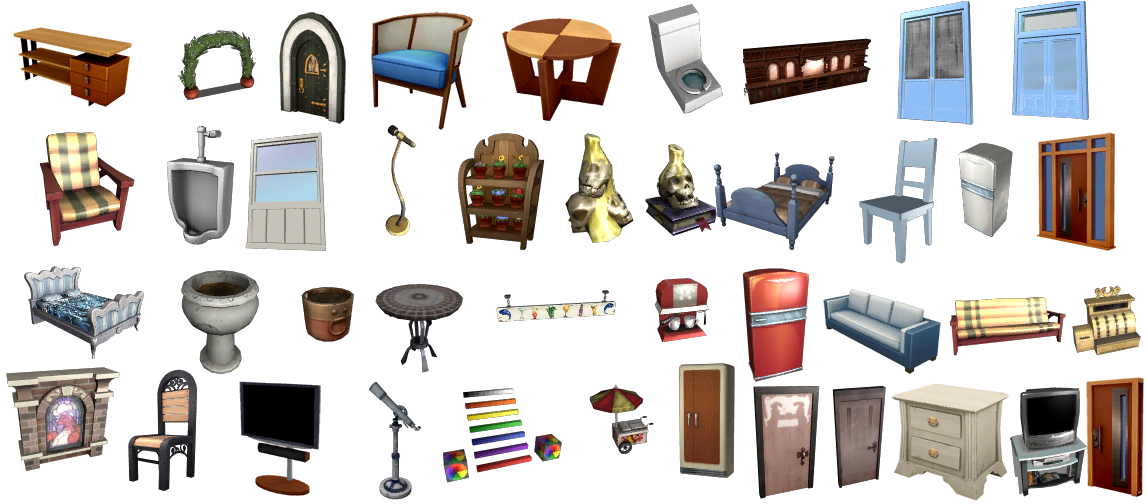
What are the coordinates of `doors/windows` in the screenshot? It's located at (928, 79), (1059, 76), (288, 202), (1070, 209), (1105, 422), (850, 444), (777, 449), (705, 430).